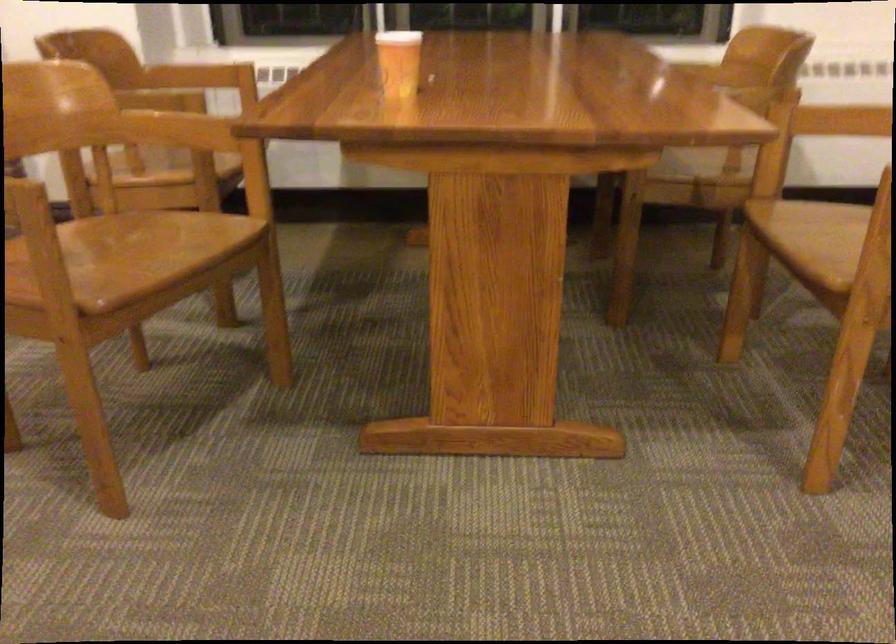
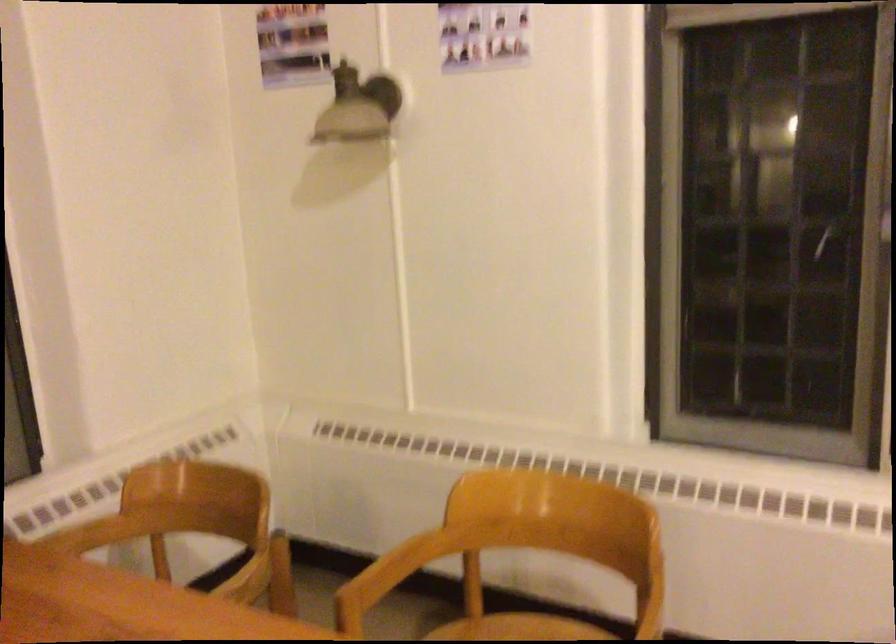
Find the pixel in the second image that matches pixel 712 71 in the first image.

(92, 534)